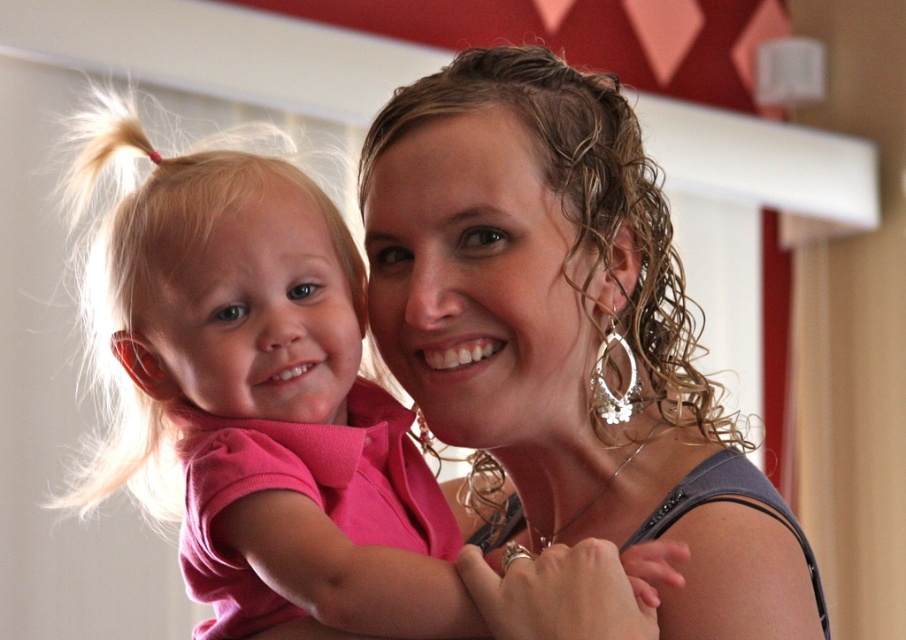
You are a photographer setting up a photo shoot. You have two shirts, a matte pink shirt at center and a pink fabric shirt at center. The client wants to know if they can be placed side by side without overlapping. The camera frame can accommodate items up to 5 inches apart. Can they be arranged this way?

The distance between the matte pink shirt at center and the pink fabric shirt at center is 5.38 inches, which exceeds the camera frame limit of 5 inches. Therefore, they cannot be placed side by side without overlapping within the given space.

You are a photographer who wants to capture a closeup of the pink fabric shirt at center and the matte pink shirt at center. Since you can only focus on one shirt at a time, which one should you focus on first if you want to ensure both are in focus without moving the camera?

The matte pink shirt at center is to the right of the pink fabric shirt at center. Since the pink fabric shirt at center is closer to the camera, you should focus on it first to ensure both are in focus.